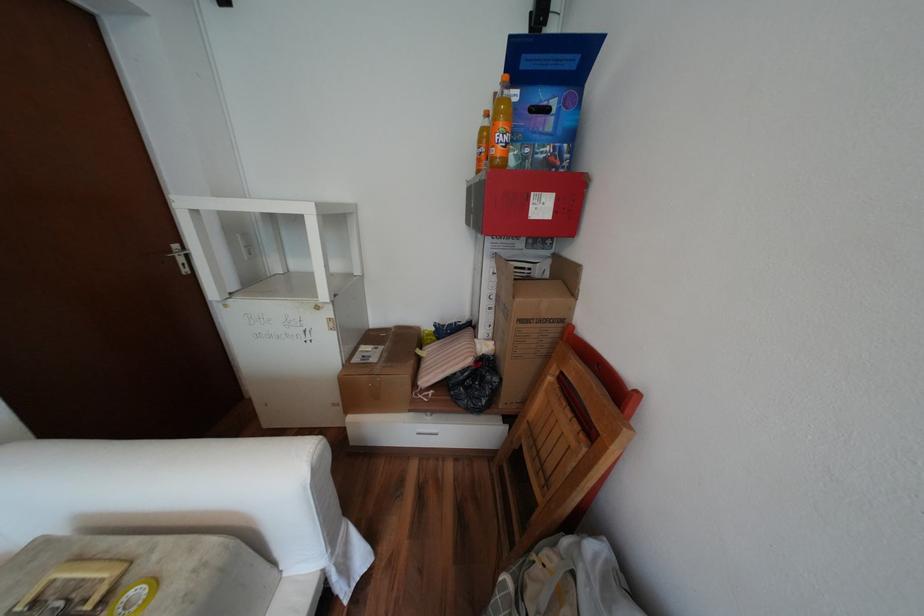
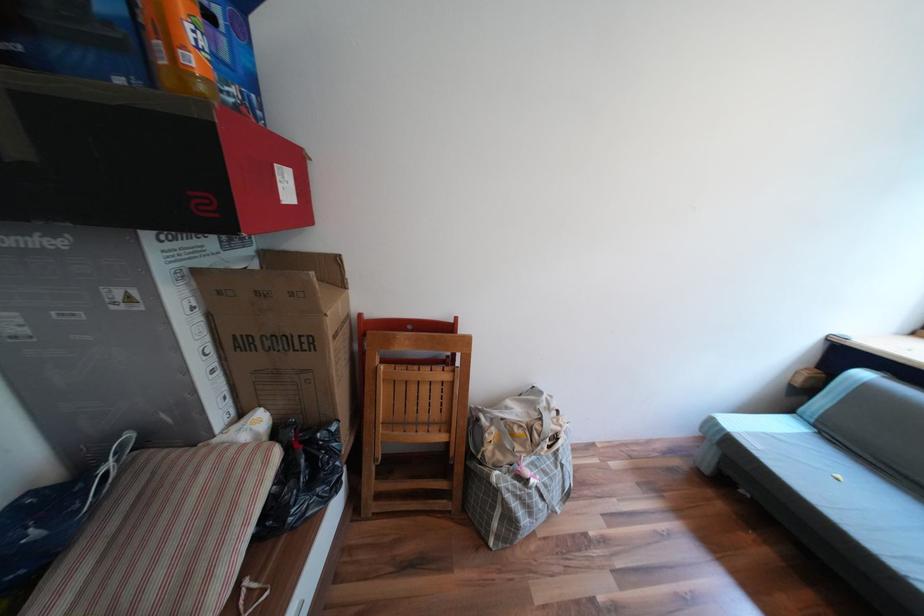
The point at (503, 297) is marked in the first image. Where is the corresponding point in the second image?

(219, 349)